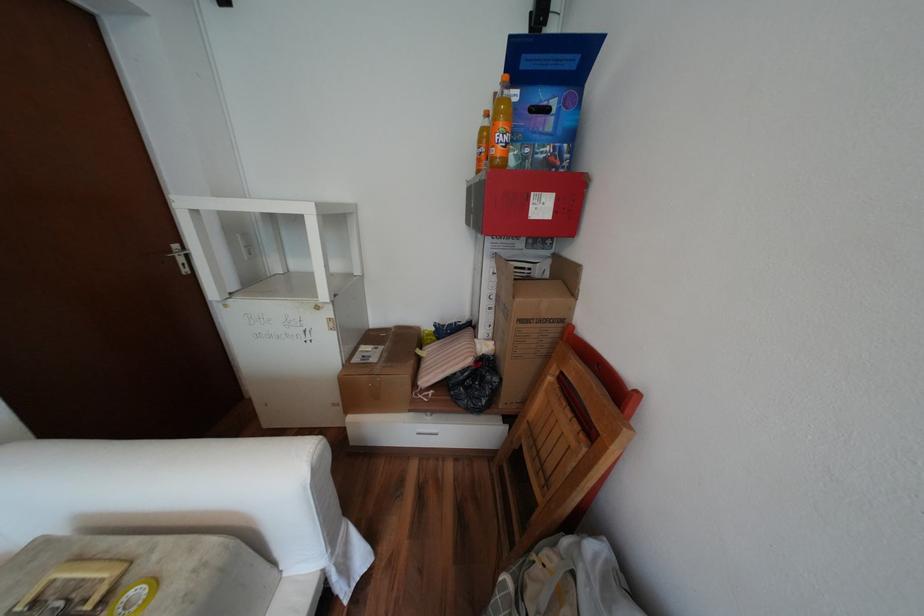
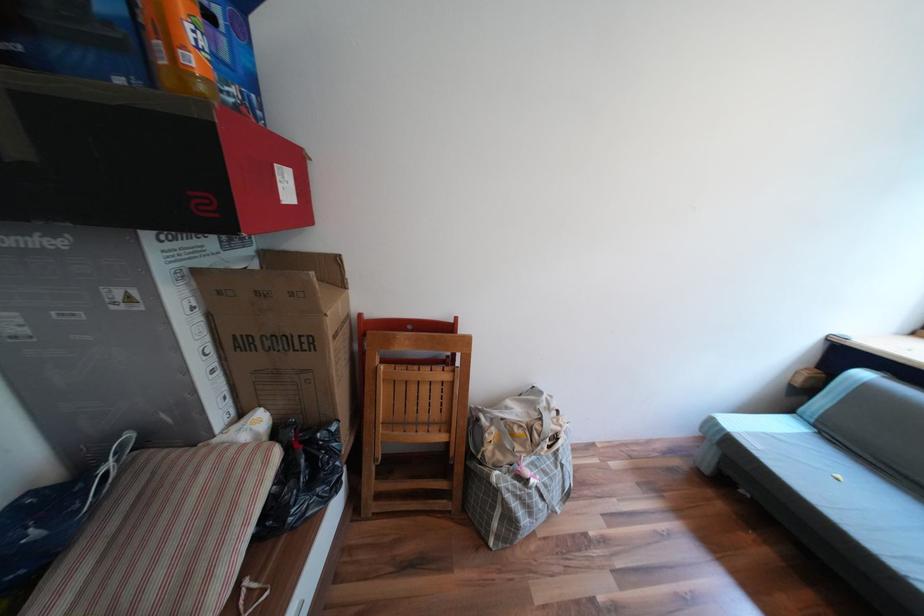
The point at (503, 297) is marked in the first image. Where is the corresponding point in the second image?

(219, 349)